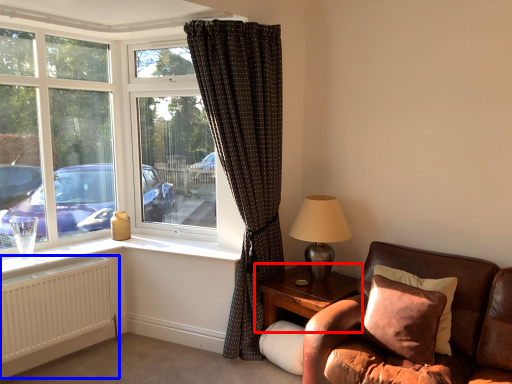
Question: Which object is further to the camera taking this photo, table (highlighted by a red box) or radiator (highlighted by a blue box)?

Choices:
 (A) table
 (B) radiator

Answer: (A)